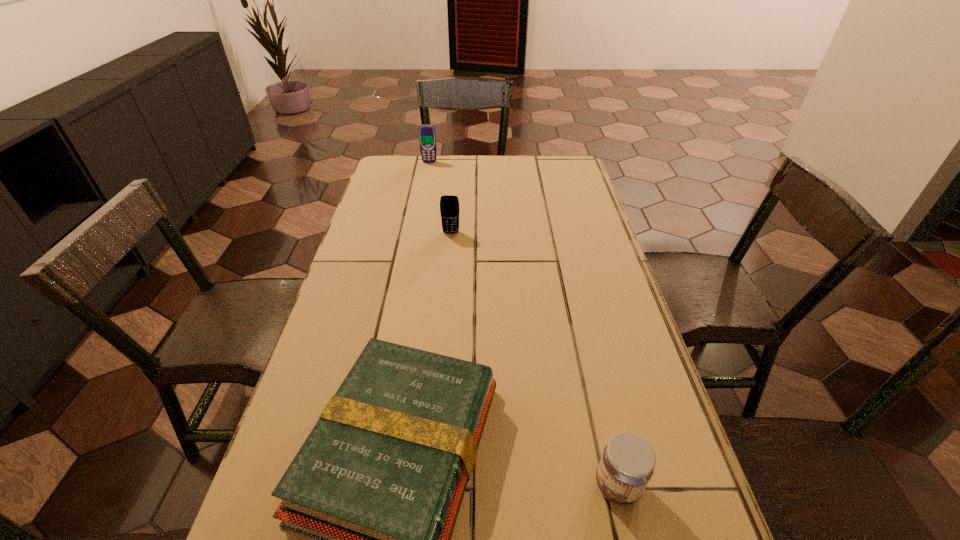
This screenshot has height=540, width=960. What are the coordinates of `the farthest object` in the screenshot? It's located at (427, 137).

Identify the location of the farther cellular telephone. The width and height of the screenshot is (960, 540). (427, 137).

At what (x,y) coordinates should I click in order to perform the action: click on the nearer cellular telephone. Please return your answer as a coordinate pair (x, y). The width and height of the screenshot is (960, 540). Looking at the image, I should click on (449, 204).

The image size is (960, 540). What are the coordinates of `the third nearest object` in the screenshot? It's located at (449, 204).

At what (x,y) coordinates should I click in order to perform the action: click on jam. Please return your answer as a coordinate pair (x, y). Looking at the image, I should click on (627, 464).

Where is `free region located on the front-facing side of the left cellular telephone`? The height and width of the screenshot is (540, 960). free region located on the front-facing side of the left cellular telephone is located at coordinates (422, 197).

You are a GUI agent. You are given a task and a screenshot of the screen. Output one action in this format:
    pyautogui.click(x=<x>, y=<y>)
    Task: Click on the vacant region located 0.080m on the screen of the nearer cellular telephone
    Image resolution: width=960 pixels, height=540 pixels.
    Given the screenshot: What is the action you would take?
    point(449,251)

Where is `vacant space located 0.070m on the front label of the rightmost object`? This screenshot has width=960, height=540. vacant space located 0.070m on the front label of the rightmost object is located at coordinates pos(555,486).

The width and height of the screenshot is (960, 540). Find the location of `free space located 0.080m on the front label of the rightmost object`. free space located 0.080m on the front label of the rightmost object is located at coordinates 549,486.

Locate an element on the screen. This screenshot has height=540, width=960. vacant space located 0.130m on the front label of the rightmost object is located at coordinates (521, 486).